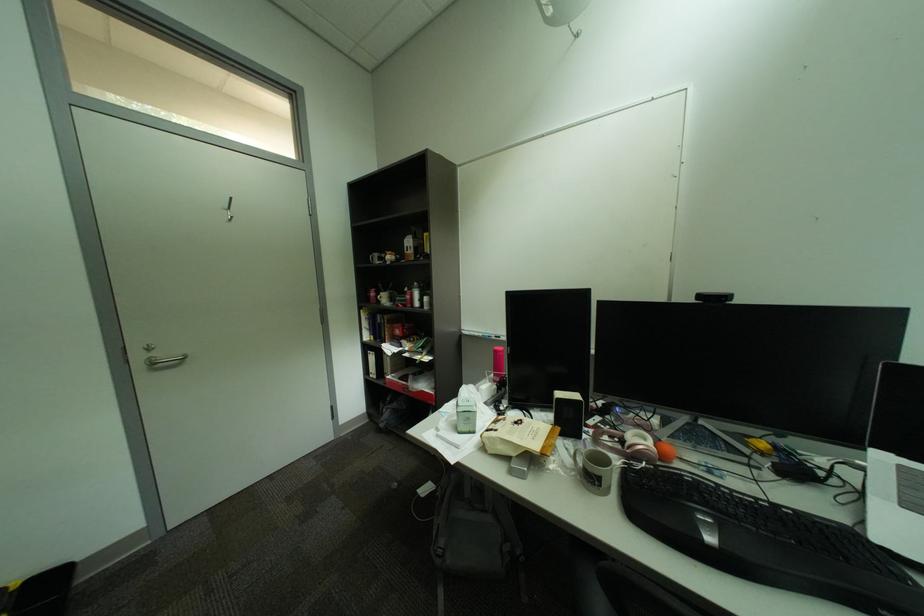
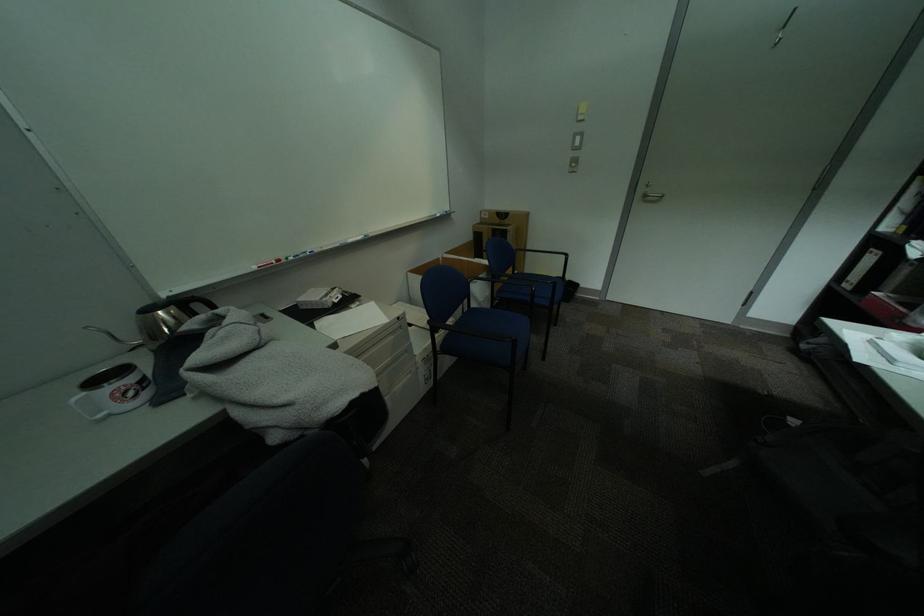
In the second image, find the point that corresponds to pixel 164 363 in the first image.

(655, 197)